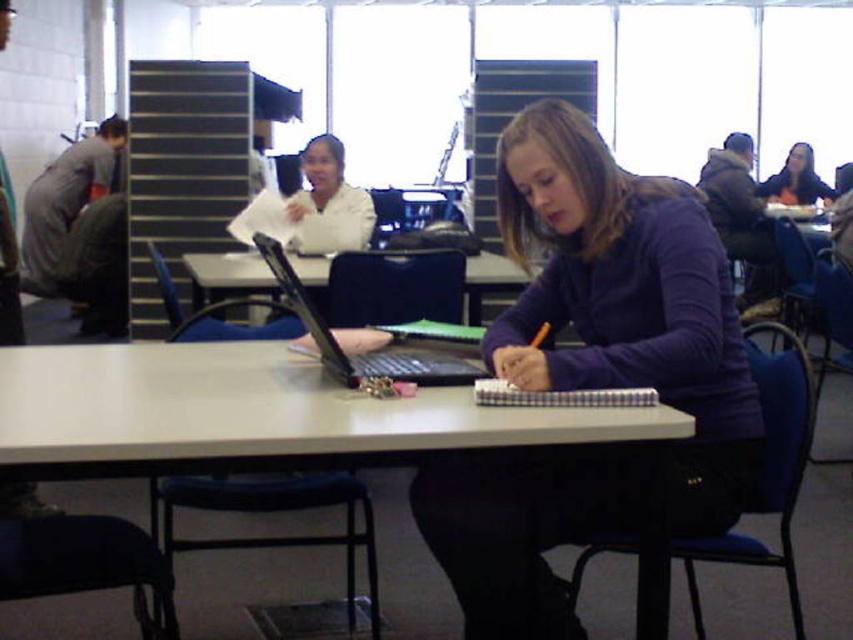
Is point (252, 273) positioned behind point (767, 192)?

No.

Who is more distant from viewer, (224, 264) or (793, 156)?

Point (793, 156)

Where is `white plastic table at center`? The height and width of the screenshot is (640, 853). white plastic table at center is located at coordinates (227, 275).

Where is `white plastic table at center`? white plastic table at center is located at coordinates (227, 275).

Is white matte table at center bigger than white matte lab coat at center?

Correct, white matte table at center is larger in size than white matte lab coat at center.

Describe the element at coordinates (257, 413) in the screenshot. I see `white matte table at center` at that location.

In order to click on white matte table at center in this screenshot , I will do `click(257, 413)`.

Who is lower down, white matte lab coat at center or checkered paper notebook at center?

checkered paper notebook at center

Does white matte lab coat at center have a greater height compared to checkered paper notebook at center?

Yes, white matte lab coat at center is taller than checkered paper notebook at center.

Which is behind, point (341, 150) or point (474, 401)?

The point (341, 150) is behind.

Where is `white matte lab coat at center`? The height and width of the screenshot is (640, 853). white matte lab coat at center is located at coordinates (329, 202).